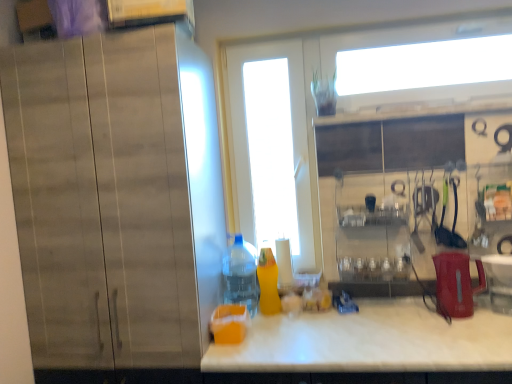
This screenshot has width=512, height=384. What do you see at coordinates (240, 276) in the screenshot? I see `translucent plastic bottle at center, which is counted as the 1th bottle, starting from the left` at bounding box center [240, 276].

The image size is (512, 384). What do you see at coordinates (270, 145) in the screenshot?
I see `white glossy screen door at center` at bounding box center [270, 145].

In order to face matte wood cabinet at left, should I rotate leftwards or rightwards?

Rotate left and turn 14.808 degrees.

Measure the distance between translucent orange juice at lower center and camera.

5.52 feet.

What do you see at coordinates (229, 324) in the screenshot?
I see `translucent orange juice at lower center` at bounding box center [229, 324].

At what (x,y) coordinates should I click in order to perform the action: click on white marble countertop at center. Please return your answer as a coordinate pair (x, y). Image resolution: width=512 pixels, height=384 pixels. Looking at the image, I should click on (370, 341).

Locate an element on the screen. The height and width of the screenshot is (384, 512). translucent plastic bottle at center, which is counted as the 1th bottle, starting from the left is located at coordinates (240, 276).

Is point (234, 179) closer or farther from the camera than point (234, 326)?

Point (234, 179) is positioned farther from the camera compared to point (234, 326).

Which object is closer to the camera taking this photo, white glossy screen door at center or translucent orange juice at lower center?

translucent orange juice at lower center is closer to the camera.

From their relative heights in the image, would you say white glossy screen door at center is taller or shorter than translucent orange juice at lower center?

In the image, white glossy screen door at center appears to be taller than translucent orange juice at lower center.

In the scene shown: Can you see translucent orange juice at lower center touching yellow glass bottle at center, which is the 2th bottle in left-to-right order?

translucent orange juice at lower center and yellow glass bottle at center, which is the 2th bottle in left-to-right order, are clearly separated.

Considering the relative sizes of translucent orange juice at lower center and yellow glass bottle at center, which is the 1th bottle from right to left, in the image provided, is translucent orange juice at lower center thinner than yellow glass bottle at center, which is the 1th bottle from right to left,?

In fact, translucent orange juice at lower center might be wider than yellow glass bottle at center, which is the 1th bottle from right to left.

Based on the photo, who is shorter, translucent orange juice at lower center or yellow glass bottle at center, which is the 2th bottle in left-to-right order?

Standing shorter between the two is translucent orange juice at lower center.

Considering the positions of point (221, 305) and point (274, 299), is point (221, 305) closer or farther from the camera than point (274, 299)?

Point (221, 305).

Considering their positions, is white glossy screen door at center located in front of or behind matte wood cabinet at left?

white glossy screen door at center is positioned farther from the viewer than matte wood cabinet at left.

Which point is more forward, (302, 71) or (19, 128)?

Positioned in front is point (19, 128).

Image resolution: width=512 pixels, height=384 pixels. I want to click on cabinetry lying on the left of white glossy screen door at center, so coord(115,197).

How many degrees apart are the facing directions of white glossy screen door at center and matte wood cabinet at left?

0.788 degrees.

From a real-world perspective, between white glossy sink at right and matte wood cabinet at left, who is vertically higher?

matte wood cabinet at left.

Considering the sizes of objects white glossy sink at right and matte wood cabinet at left in the image provided, who is thinner, white glossy sink at right or matte wood cabinet at left?

white glossy sink at right is thinner.

Is white glossy sink at right positioned beyond the bounds of matte wood cabinet at left?

Indeed, white glossy sink at right is completely outside matte wood cabinet at left.

The width and height of the screenshot is (512, 384). I want to click on cabinetry above the white glossy sink at right (from the image's perspective), so click(115, 197).

From the image's perspective, which one is positioned higher, yellow glass bottle at center, which is the 2th bottle in left-to-right order, or white glossy sink at right?

From the image's view, white glossy sink at right is above.

Is yellow glass bottle at center, which is the 2th bottle in left-to-right order, aimed at white glossy sink at right?

No, yellow glass bottle at center, which is the 2th bottle in left-to-right order, does not turn towards white glossy sink at right.

Considering the points (279, 312) and (510, 241), which point is behind, point (279, 312) or point (510, 241)?

Positioned behind is point (279, 312).

Is yellow glass bottle at center, which is the 1th bottle from right to left, to the left or to the right of white glossy sink at right in the image?

Based on their positions, yellow glass bottle at center, which is the 1th bottle from right to left, is located to the left of white glossy sink at right.

Considering the relative sizes of white glossy screen door at center and translucent plastic bottle at center, arranged as the 2th bottle when viewed from the right, in the image provided, is white glossy screen door at center shorter than translucent plastic bottle at center, arranged as the 2th bottle when viewed from the right,?

No, white glossy screen door at center is not shorter than translucent plastic bottle at center, arranged as the 2th bottle when viewed from the right.

Would you say white glossy screen door at center is to the left or to the right of translucent plastic bottle at center, arranged as the 2th bottle when viewed from the right, in the picture?

white glossy screen door at center is to the right of translucent plastic bottle at center, arranged as the 2th bottle when viewed from the right.

Could you tell me if white glossy screen door at center is turned towards translucent plastic bottle at center, which is counted as the 1th bottle, starting from the left?

Yes, white glossy screen door at center faces towards translucent plastic bottle at center, which is counted as the 1th bottle, starting from the left.

Is white glossy screen door at center beside translucent plastic bottle at center, which is counted as the 1th bottle, starting from the left?

No, white glossy screen door at center is not beside translucent plastic bottle at center, which is counted as the 1th bottle, starting from the left.

From the picture: Would you say white glossy screen door at center is a long distance from red plastic kettle at right?

Yes, white glossy screen door at center is far from red plastic kettle at right.

Considering the sizes of objects white glossy screen door at center and red plastic kettle at right in the image provided, who is bigger, white glossy screen door at center or red plastic kettle at right?

Bigger between the two is white glossy screen door at center.

From a real-world perspective, is white glossy screen door at center positioned over red plastic kettle at right based on gravity?

Yes, from a real-world perspective, white glossy screen door at center is above red plastic kettle at right.

In order to click on juice below the white glossy screen door at center (from the image's perspective) in this screenshot , I will do `click(229, 324)`.

From the image's perspective, which bottle is the 1st one above the translucent orange juice at lower center? Please provide its 2D coordinates.

[(268, 283)]

Looking at the image, which one is located further to red plastic kettle at right, white glossy screen door at center or matte wood cabinet at left?

white glossy screen door at center.

Estimate the real-world distances between objects in this image. Which object is further from translucent orange juice at lower center, yellow glass bottle at center, which is the 2th bottle in left-to-right order, or matte wood cabinet at left?

Based on the image, matte wood cabinet at left appears to be further to translucent orange juice at lower center.

When comparing their distances from white glossy sink at right, does matte wood cabinet at left or translucent orange juice at lower center seem closer?

Based on the image, translucent orange juice at lower center appears to be nearer to white glossy sink at right.

Which object lies nearer to the anchor point translucent orange juice at lower center, white marble countertop at center or red plastic kettle at right?

The object closer to translucent orange juice at lower center is white marble countertop at center.

Looking at the image, which one is located closer to translucent orange juice at lower center, white glossy screen door at center or yellow glass bottle at center, which is the 1th bottle from right to left?

yellow glass bottle at center, which is the 1th bottle from right to left, is positioned closer to the anchor translucent orange juice at lower center.

From the image, which object appears to be farther from white glossy screen door at center, translucent orange juice at lower center or red plastic kettle at right?

translucent orange juice at lower center lies further to white glossy screen door at center than the other object.

Looking at the image, which one is located further to white glossy screen door at center, translucent plastic bottle at center, arranged as the 2th bottle when viewed from the right, or white glossy sink at right?

Among the two, white glossy sink at right is located further to white glossy screen door at center.

Considering their positions, is yellow glass bottle at center, which is the 2th bottle in left-to-right order, positioned further to white glossy screen door at center than red plastic kettle at right?

red plastic kettle at right lies further to white glossy screen door at center than the other object.

I want to click on bottle between white marble countertop at center and yellow glass bottle at center, which is the 2th bottle in left-to-right order, along the z-axis, so click(x=240, y=276).

Where is `screen door between yellow glass bottle at center, which is the 1th bottle from right to left, and white glossy sink at right from left to right`? The image size is (512, 384). screen door between yellow glass bottle at center, which is the 1th bottle from right to left, and white glossy sink at right from left to right is located at coordinates (270, 145).

Locate an element on the screen. This screenshot has height=384, width=512. screen door between matte wood cabinet at left and white marble countertop at center in the horizontal direction is located at coordinates (270, 145).

This screenshot has width=512, height=384. Identify the location of screen door between yellow glass bottle at center, which is the 1th bottle from right to left, and red plastic kettle at right. (270, 145).